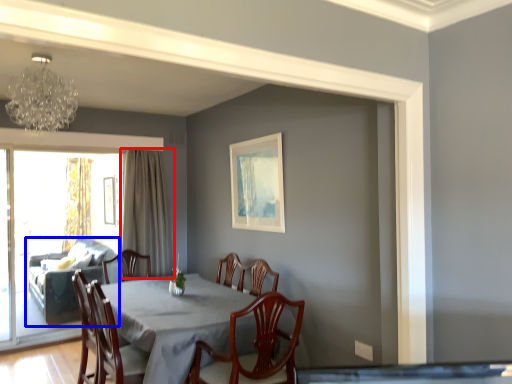
Question: Which of the following is the closest to the observer, curtain (highlighted by a red box) or studio couch (highlighted by a blue box)?

Choices:
 (A) curtain
 (B) studio couch

Answer: (A)